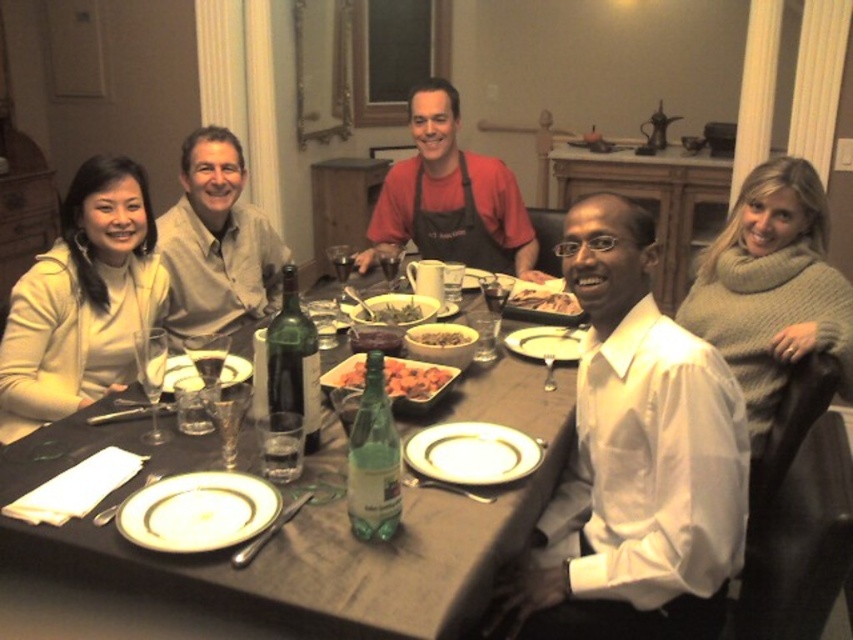
Can you confirm if shiny glass bowl at center is positioned to the left of brown matte rice bowl at center?

Indeed, shiny glass bowl at center is positioned on the left side of brown matte rice bowl at center.

Which of these two, shiny glass bowl at center or brown matte rice bowl at center, stands taller?

shiny glass bowl at center is taller.

Which is behind, point (340, 380) or point (444, 340)?

Positioned behind is point (444, 340).

The image size is (853, 640). What are the coordinates of `shiny glass bowl at center` in the screenshot? It's located at (415, 378).

Can you confirm if white matte sweater at lower left is smaller than white porcelain plate at lower left?

Incorrect, white matte sweater at lower left is not smaller in size than white porcelain plate at lower left.

Find the location of a particular element. Image resolution: width=853 pixels, height=640 pixels. white matte sweater at lower left is located at coordinates (82, 300).

Who is more distant from viewer, (33,268) or (142,490)?

The point (33,268) is more distant.

Identify the location of white matte sweater at lower left. This screenshot has height=640, width=853. (82, 300).

Between white matte sweater at lower left and green glass platter at center, which one has less height?

Standing shorter between the two is green glass platter at center.

Is point (128, 160) farther from camera compared to point (242, 356)?

Yes, point (128, 160) is farther from viewer.

In order to click on white matte sweater at lower left in this screenshot , I will do `click(82, 300)`.